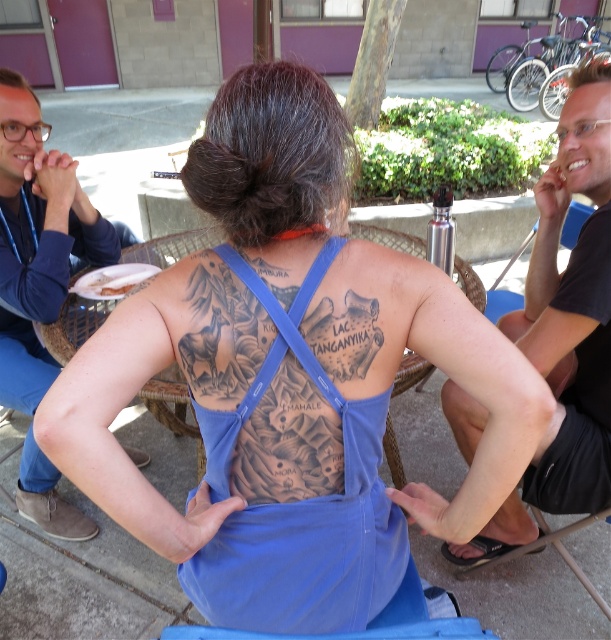
Question: Which of the following is the farthest from the observer?

Choices:
 (A) (147, 275)
 (B) (20, 152)
 (C) (260, 288)

Answer: (A)

Question: Can you confirm if blue fabric apron at center is wider than blue denim jeans at left?

Choices:
 (A) yes
 (B) no

Answer: (A)

Question: Does blue fabric apron at center lie in front of white paper napkin at upper left?

Choices:
 (A) no
 (B) yes

Answer: (B)

Question: From the image, what is the correct spatial relationship of blue denim jeans at left in relation to white paper napkin at upper left?

Choices:
 (A) right
 (B) left

Answer: (B)

Question: Which point is closer to the camera?

Choices:
 (A) blue denim jeans at left
 (B) black matte water bottle at upper center
 (C) blue fabric apron at center
 (D) white paper napkin at upper left

Answer: (C)

Question: Considering the real-world distances, which object is closest to the white paper napkin at upper left?

Choices:
 (A) black matte water bottle at upper center
 (B) blue denim jeans at left
 (C) blue fabric apron at center

Answer: (B)